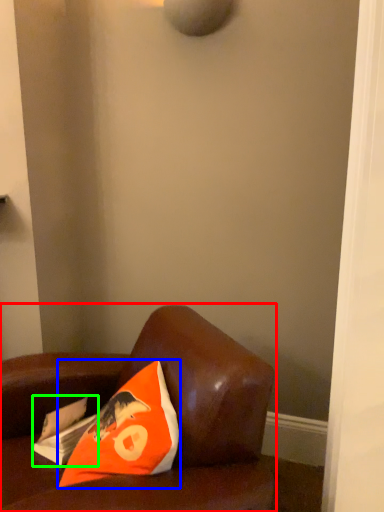
Question: Which object is positioned closest to furniture (highlighted by a red box)? Select from pillow (highlighted by a blue box) and magazine (highlighted by a green box).

Choices:
 (A) pillow
 (B) magazine

Answer: (A)